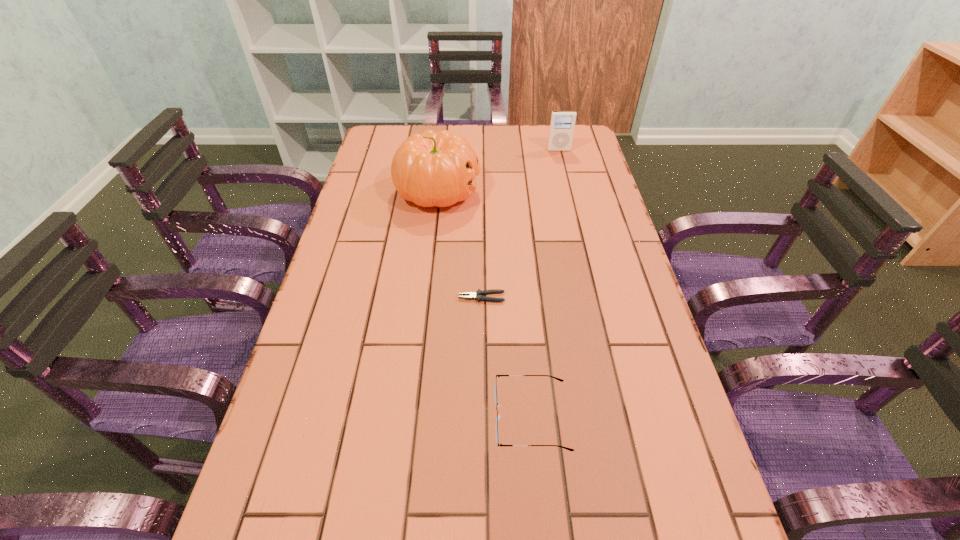
Where is `vacant space located on the lenses of the spectacles`? vacant space located on the lenses of the spectacles is located at coordinates (337, 417).

Find the location of a particular element. Image resolution: width=960 pixels, height=540 pixels. vacant area situated 0.340m on the lenses of the spectacles is located at coordinates (322, 417).

Locate an element on the screen. The image size is (960, 540). vacant space located on the lenses of the spectacles is located at coordinates (343, 417).

Locate an element on the screen. The width and height of the screenshot is (960, 540). vacant space situated 0.080m at the gripping part of the second nearest object is located at coordinates (426, 298).

Find the location of a particular element. The height and width of the screenshot is (540, 960). vacant space located at the gripping part of the second nearest object is located at coordinates (373, 298).

What are the coordinates of `vacant space located 0.250m at the gripping part of the second nearest object` in the screenshot? It's located at (357, 298).

Locate an element on the screen. object positioned at the far edge is located at coordinates (562, 124).

Identify the location of object that is at the left edge. This screenshot has width=960, height=540. click(x=430, y=169).

Locate an element on the screen. This screenshot has height=540, width=960. object positioned at the right edge is located at coordinates (562, 124).

In order to click on object that is at the far right corner in this screenshot , I will do `click(562, 124)`.